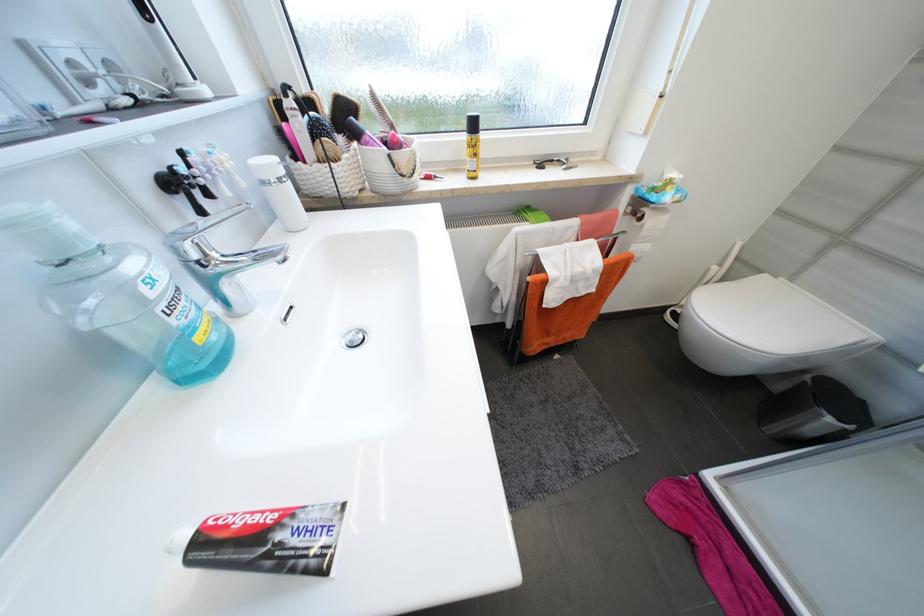
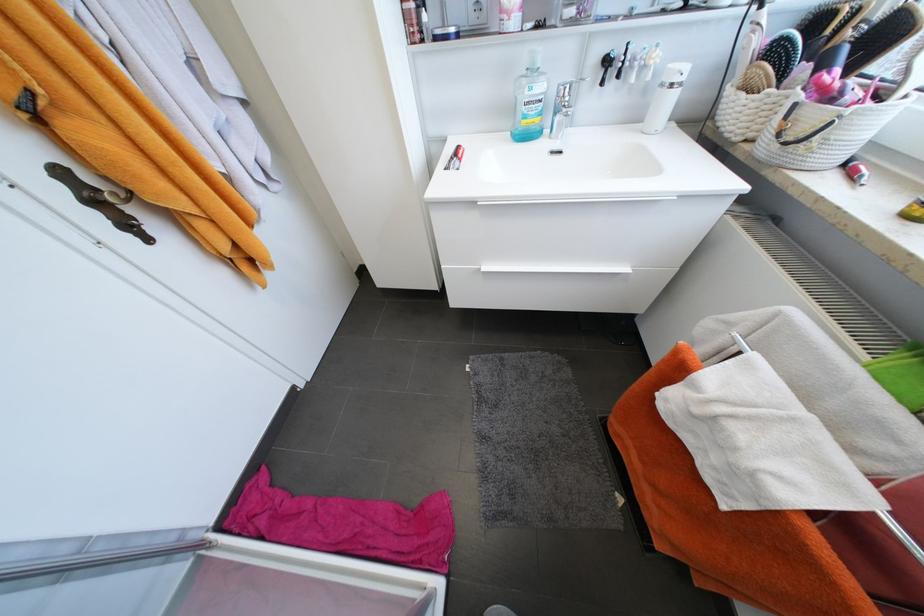
Where in the second image is the point corresponding to pixel 178 185 from the first image?

(613, 62)